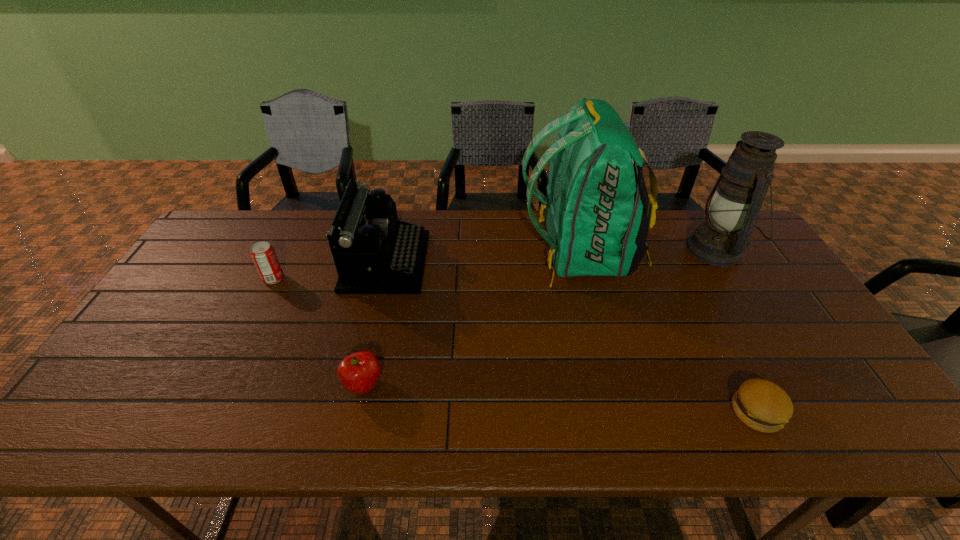
The height and width of the screenshot is (540, 960). Identify the location of vacant space situated 0.170m on the front of the oil lamp. (759, 319).

In order to click on vacant space located 0.340m on the typing side of the typewriter in this screenshot , I will do `click(535, 262)`.

You are a GUI agent. You are given a task and a screenshot of the screen. Output one action in this format:
    pyautogui.click(x=<x>, y=<y>)
    Task: Click on the vacant space positioned on the right of the leftmost object
    This screenshot has width=960, height=540.
    Given the screenshot: What is the action you would take?
    pyautogui.click(x=334, y=279)

Locate an element on the screen. Image resolution: width=960 pixels, height=540 pixels. vacant space located 0.350m on the right of the apple is located at coordinates (530, 385).

I want to click on free space located on the right of the hamburger, so click(x=807, y=412).

Identify the location of backpack positioned at the far edge. This screenshot has width=960, height=540. coord(598,212).

At what (x,y) coordinates should I click in order to perform the action: click on oil lamp at the far edge. Please return your answer as a coordinate pair (x, y). This screenshot has width=960, height=540. Looking at the image, I should click on (734, 203).

Find the location of a particular element. The image size is (960, 540). typewriter situated at the far edge is located at coordinates (375, 253).

Locate an element on the screen. This screenshot has height=540, width=960. object that is positioned at the near edge is located at coordinates (762, 405).

Find the location of `object present at the right edge`. object present at the right edge is located at coordinates (734, 203).